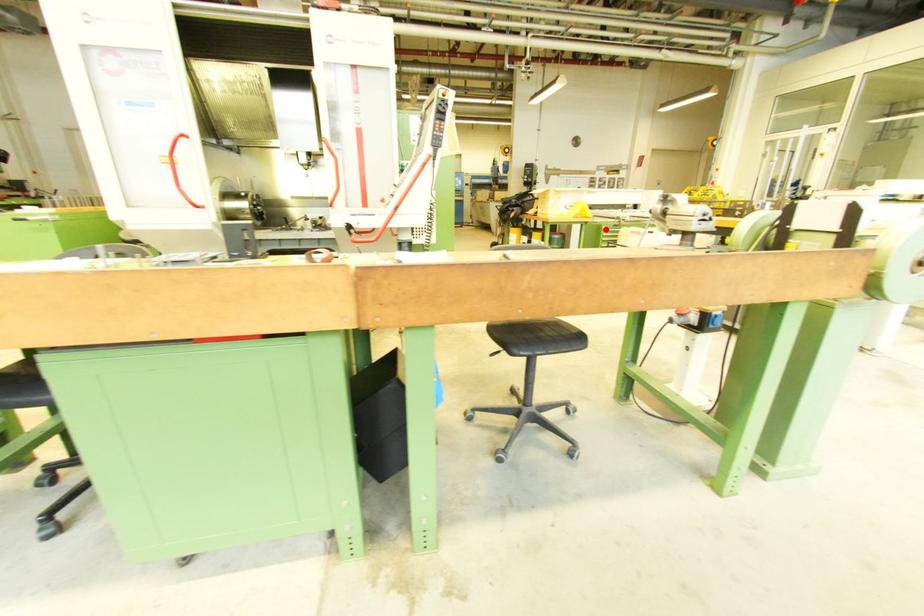
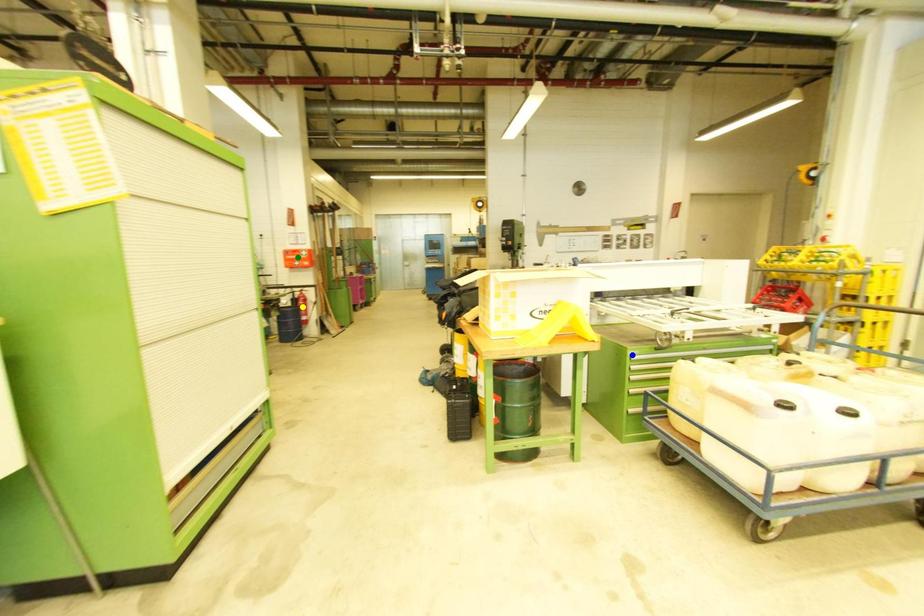
Question: I am providing you with two images of the same scene from different viewpoints. A red point is marked on the first image. You are given multiple points on the second image. In image 2, which mark is for the same physical point as the one in image 1?

Choices:
 (A) green point
 (B) yellow point
 (C) blue point

Answer: (C)